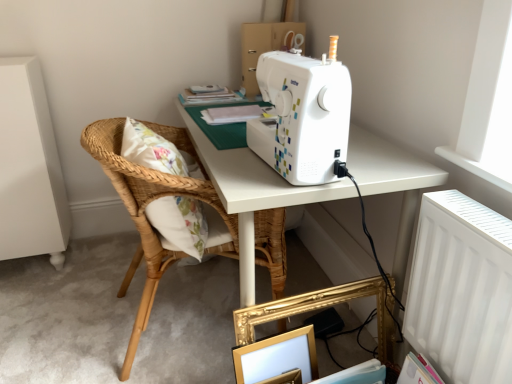
At what (x,y) coordinates should I click in order to perform the action: click on vacant region to the left of white plastic sewing machine at upper center. Please return your answer as a coordinate pair (x, y). Looking at the image, I should click on (241, 164).